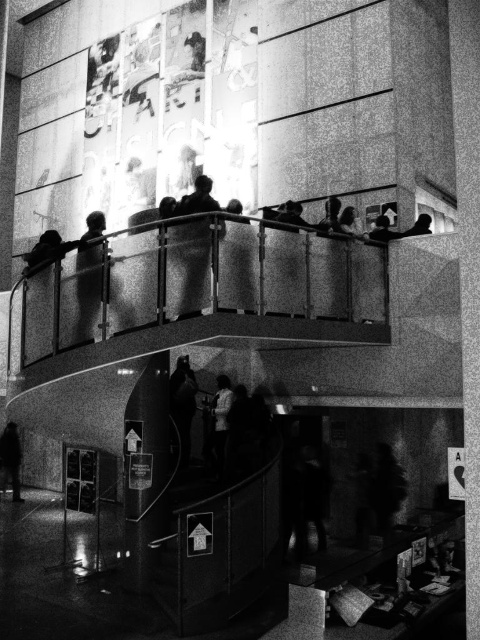
Can you confirm if smooth black jacket at upper left is taller than smooth black jacket at lower left?

In fact, smooth black jacket at upper left may be shorter than smooth black jacket at lower left.

Identify the location of smooth black jacket at upper left. (87, 301).

Which is behind, point (92, 284) or point (9, 449)?

Point (9, 449)

You are a GUI agent. You are given a task and a screenshot of the screen. Output one action in this format:
    pyautogui.click(x=<x>, y=<y>)
    Task: Click on the smooth black jacket at upper left
    This screenshot has height=640, width=480.
    Given the screenshot: What is the action you would take?
    pyautogui.click(x=87, y=301)

Can you confirm if dark textured jacket at center is taller than white fabric jacket at center?

Incorrect, dark textured jacket at center's height is not larger of white fabric jacket at center's.

From the picture: Is dark textured jacket at center wider than white fabric jacket at center?

Yes, dark textured jacket at center is wider than white fabric jacket at center.

Between point (206, 248) and point (220, 467), which one is positioned in front?

Point (206, 248)

Locate an element on the screen. dark textured jacket at center is located at coordinates (192, 260).

How much distance is there between white fabric jacket at center and smooth black jacket at lower left?

white fabric jacket at center is 9.24 meters from smooth black jacket at lower left.

Who is taller, white fabric jacket at center or smooth black jacket at lower left?

smooth black jacket at lower left

This screenshot has width=480, height=640. Identify the location of white fabric jacket at center. (218, 420).